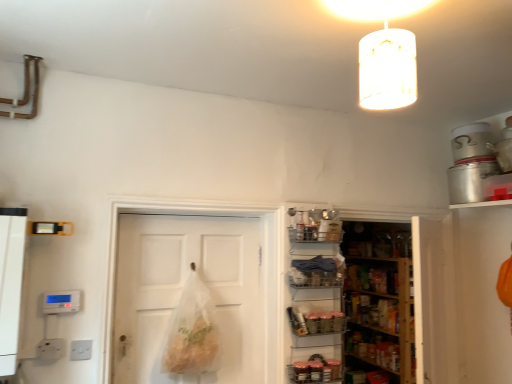
The width and height of the screenshot is (512, 384). What do you see at coordinates (316, 370) in the screenshot?
I see `shiny metallic jars at center` at bounding box center [316, 370].

Describe the element at coordinates (384, 52) in the screenshot. The image size is (512, 384). I see `translucent white cylinder at upper center` at that location.

The image size is (512, 384). Identify the location of translucent white cylinder at upper center. (384, 52).

Measure the distance between white matte door at center and camera.

They are 2.20 meters apart.

I want to click on metallic wire basket at center, which ranks as the 2th shelf in top-to-bottom order, so click(316, 318).

Identify the location of metallic wire basket at center, the second shelf in the bottom-to-top sequence. (315, 272).

Choose the correct answer: Is white matte door at center inside wooden shelves at center or outside it?

The correct answer is: outside.

Is white matte door at center oriented towards wooden shelves at center?

No, white matte door at center does not turn towards wooden shelves at center.

From a real-world perspective, is white matte door at center over wooden shelves at center?

Incorrect, from a real-world perspective, white matte door at center is lower than wooden shelves at center.

Starting from the wooden shelves at center, which shelf is the 1st one to the left? Please provide its 2D coordinates.

[(315, 272)]

Based on their sizes in the image, would you say metallic wire basket at center, the second shelf in the bottom-to-top sequence, is bigger or smaller than wooden shelves at center?

metallic wire basket at center, the second shelf in the bottom-to-top sequence, is smaller than wooden shelves at center.

Is metallic wire basket at center, arranged as the first shelf when viewed from the top, inside or outside of wooden shelves at center?

metallic wire basket at center, arranged as the first shelf when viewed from the top, is not enclosed by wooden shelves at center.

Does metallic wire basket at center, the second shelf in the bottom-to-top sequence, touch wooden shelves at center?

No, metallic wire basket at center, the second shelf in the bottom-to-top sequence, is not with wooden shelves at center.

Which is closer, (329, 267) or (346, 4)?

The point (346, 4) is closer.

This screenshot has height=384, width=512. I want to click on light fixture in front of the metallic wire basket at center, the second shelf in the bottom-to-top sequence, so click(384, 52).

From the image's perspective, relative to translucent white cylinder at upper center, is metallic wire basket at center, the second shelf in the bottom-to-top sequence, above or below?

metallic wire basket at center, the second shelf in the bottom-to-top sequence, is situated lower than translucent white cylinder at upper center in the image.

Could you tell me if metallic wire basket at center, the second shelf in the bottom-to-top sequence, is facing translucent white cylinder at upper center?

No, metallic wire basket at center, the second shelf in the bottom-to-top sequence, is not turned towards translucent white cylinder at upper center.

Measure the distance from wooden shelves at center to translucent white cylinder at upper center.

wooden shelves at center is 1.86 meters from translucent white cylinder at upper center.

Looking at this image, from a real-world perspective, does wooden shelves at center sit lower than translucent white cylinder at upper center?

Correct, in the physical world, wooden shelves at center is lower than translucent white cylinder at upper center.

Can you tell me how much wooden shelves at center and translucent white cylinder at upper center differ in facing direction?

The angular difference between wooden shelves at center and translucent white cylinder at upper center is 179 degrees.

Is wooden shelves at center located outside translucent white cylinder at upper center?

Absolutely, wooden shelves at center is external to translucent white cylinder at upper center.

Between translucent white cylinder at upper center and shiny metallic jars at center, which one appears on the left side from the viewer's perspective?

shiny metallic jars at center.

From the picture: Does translucent white cylinder at upper center contain shiny metallic jars at center?

No, translucent white cylinder at upper center does not contain shiny metallic jars at center.

Considering the relative sizes of translucent white cylinder at upper center and shiny metallic jars at center in the image provided, is translucent white cylinder at upper center taller than shiny metallic jars at center?

Correct, translucent white cylinder at upper center is much taller as shiny metallic jars at center.

From the image's perspective, is translucent white cylinder at upper center on top of shiny metallic jars at center?

Indeed, from the image's perspective, translucent white cylinder at upper center is shown above shiny metallic jars at center.

Based on their sizes in the image, would you say white matte door at center is bigger or smaller than metallic wire basket at center, positioned as the first shelf in bottom-to-top order?

white matte door at center is bigger than metallic wire basket at center, positioned as the first shelf in bottom-to-top order.

Can you confirm if white matte door at center is positioned to the right of metallic wire basket at center, which ranks as the 2th shelf in top-to-bottom order?

Incorrect, white matte door at center is not on the right side of metallic wire basket at center, which ranks as the 2th shelf in top-to-bottom order.

Is white matte door at center situated inside metallic wire basket at center, positioned as the first shelf in bottom-to-top order, or outside?

white matte door at center is spatially situated outside metallic wire basket at center, positioned as the first shelf in bottom-to-top order.

Can you tell me how much white matte door at center and metallic wire basket at center, which ranks as the 2th shelf in top-to-bottom order, differ in facing direction?

There is a 0.000588-degree angle between the facing directions of white matte door at center and metallic wire basket at center, which ranks as the 2th shelf in top-to-bottom order.

Considering the relative sizes of translucent white cylinder at upper center and wooden shelves at center in the image provided, is translucent white cylinder at upper center smaller than wooden shelves at center?

Correct, translucent white cylinder at upper center occupies less space than wooden shelves at center.

Is translucent white cylinder at upper center in front of or behind wooden shelves at center in the image?

translucent white cylinder at upper center is in front of wooden shelves at center.

Could you tell me if translucent white cylinder at upper center is turned towards wooden shelves at center?

No.

In the image, is translucent white cylinder at upper center on the left side or the right side of wooden shelves at center?

Based on their positions, translucent white cylinder at upper center is located to the left of wooden shelves at center.

You are a GUI agent. You are given a task and a screenshot of the screen. Output one action in this format:
    pyautogui.click(x=<x>, y=<y>)
    Task: Click on the door above the wooden shelves at center (from the image's perspective)
    
    Given the screenshot: What is the action you would take?
    pyautogui.click(x=182, y=291)

Locate an element on the screen. The image size is (512, 384). cabinetry behind the metallic wire basket at center, the second shelf in the bottom-to-top sequence is located at coordinates (369, 311).

Based on their spatial positions, is metallic wire basket at center, the second shelf in the bottom-to-top sequence, or white matte door at center closer to shiny metallic jars at center?

Among the two, metallic wire basket at center, the second shelf in the bottom-to-top sequence, is located nearer to shiny metallic jars at center.

In the scene shown: From the image, which object appears to be nearer to metallic wire basket at center, the second shelf in the bottom-to-top sequence, wooden shelves at center or metallic wire basket at center, positioned as the first shelf in bottom-to-top order?

metallic wire basket at center, positioned as the first shelf in bottom-to-top order.

Looking at the image, which one is located further to translucent white cylinder at upper center, shiny metallic jars at center or metallic wire basket at center, arranged as the first shelf when viewed from the top?

shiny metallic jars at center.

When comparing their distances from white matte door at center, does translucent white cylinder at upper center or wooden shelves at center seem closer?

wooden shelves at center lies closer to white matte door at center than the other object.

In the scene shown: Based on their spatial positions, is wooden shelves at center or metallic wire basket at center, the second shelf in the bottom-to-top sequence, further from white matte door at center?

The object further to white matte door at center is wooden shelves at center.

Based on their spatial positions, is translucent white cylinder at upper center or metallic wire basket at center, which ranks as the 2th shelf in top-to-bottom order, closer to metallic wire basket at center, the second shelf in the bottom-to-top sequence?

metallic wire basket at center, which ranks as the 2th shelf in top-to-bottom order, lies closer to metallic wire basket at center, the second shelf in the bottom-to-top sequence, than the other object.

Estimate the real-world distances between objects in this image. Which object is closer to white matte door at center, translucent white cylinder at upper center or metallic wire basket at center, arranged as the first shelf when viewed from the top?

metallic wire basket at center, arranged as the first shelf when viewed from the top.

From the image, which object appears to be nearer to translucent white cylinder at upper center, metallic wire basket at center, which ranks as the 2th shelf in top-to-bottom order, or white matte door at center?

metallic wire basket at center, which ranks as the 2th shelf in top-to-bottom order.

Locate an element on the screen. cabinetry between translucent white cylinder at upper center and metallic wire basket at center, which ranks as the 2th shelf in top-to-bottom order, in the up-down direction is located at coordinates (369, 311).

Where is `door between translucent white cylinder at upper center and wooden shelves at center vertically`? The image size is (512, 384). door between translucent white cylinder at upper center and wooden shelves at center vertically is located at coordinates (182, 291).

Image resolution: width=512 pixels, height=384 pixels. I want to click on shelf between white matte door at center and metallic wire basket at center, the second shelf in the bottom-to-top sequence, so click(316, 318).

You are a GUI agent. You are given a task and a screenshot of the screen. Output one action in this format:
    pyautogui.click(x=<x>, y=<y>)
    Task: Click on the shelf that lies between metallic wire basket at center, the second shelf in the bottom-to-top sequence, and shiny metallic jars at center from top to bottom
    The image size is (512, 384).
    Given the screenshot: What is the action you would take?
    pyautogui.click(x=316, y=318)